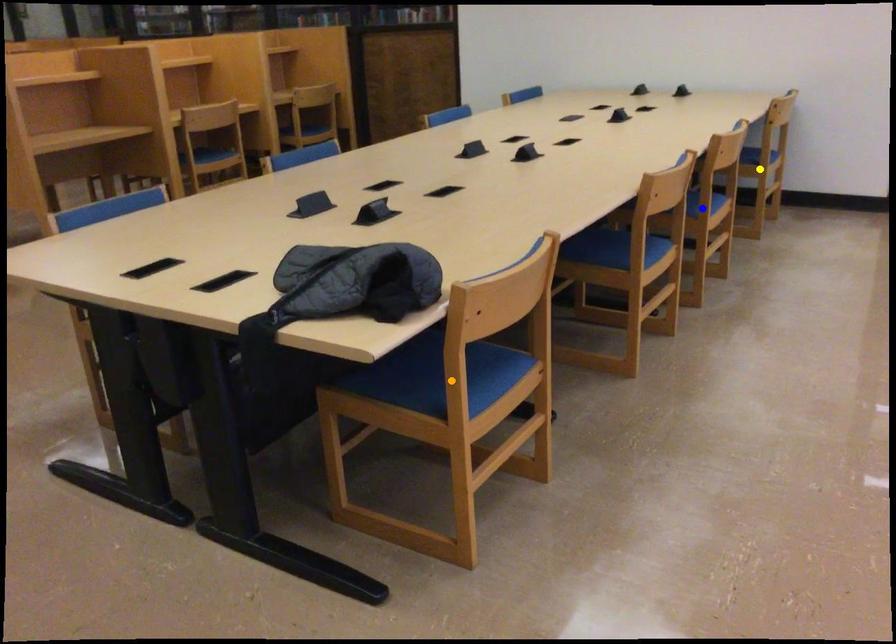
Order these from nearest to farthest:
A) blue point
B) orange point
C) yellow point

orange point, blue point, yellow point